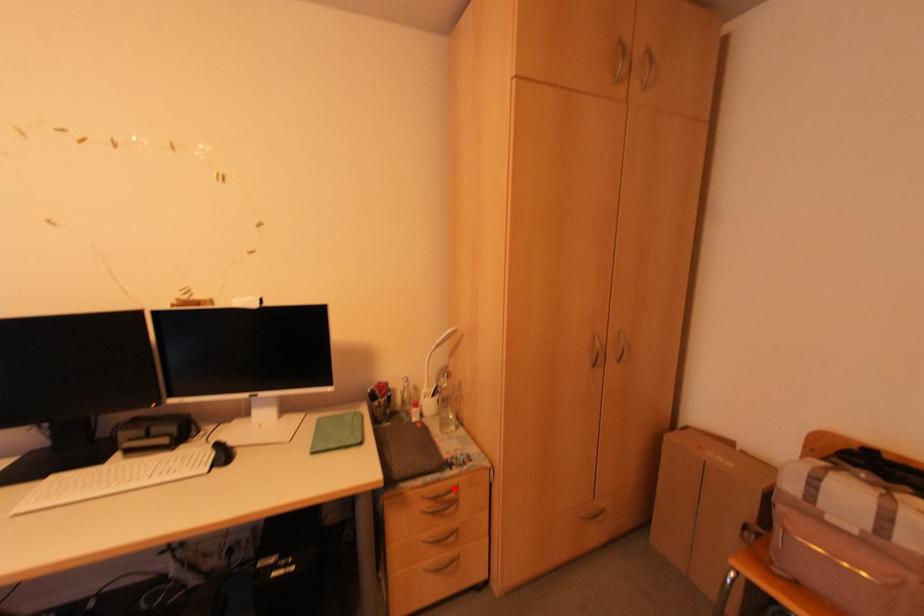
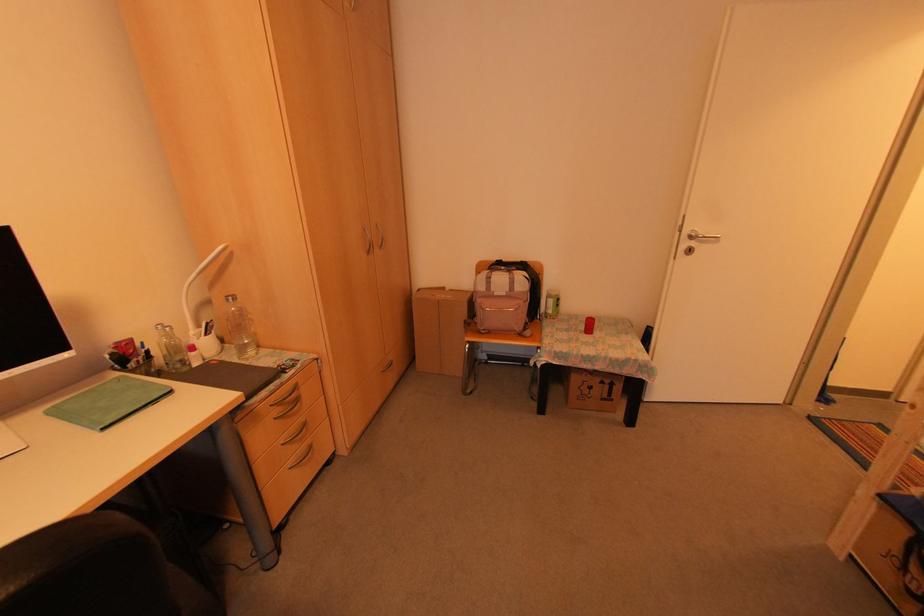
Question: I am providing you with two images of the same scene from different viewpoints. A red point is marked on the first image. At the location where the point appears in image 1, is it still visible in image 2?

Choices:
 (A) Yes
 (B) No

Answer: (A)